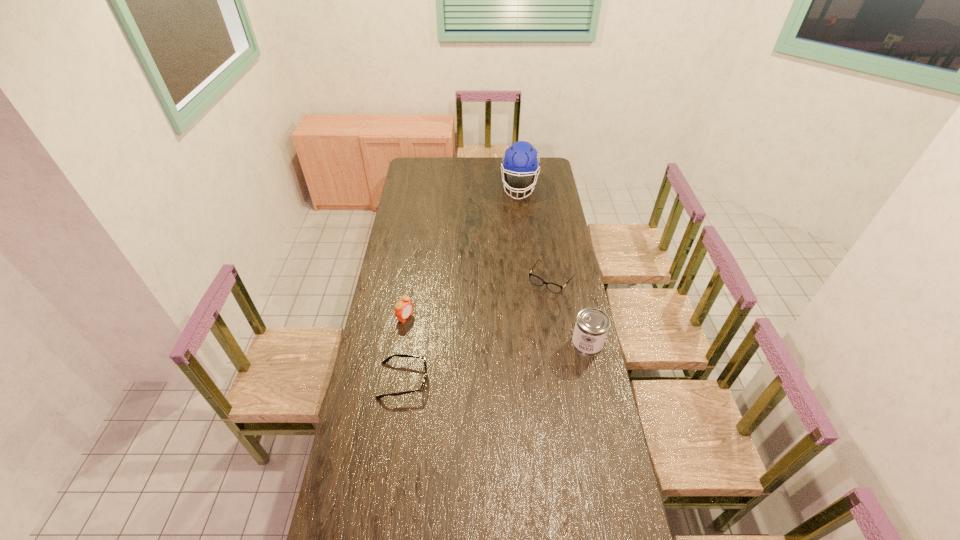
I want to click on free space at the right edge, so click(x=546, y=203).

Image resolution: width=960 pixels, height=540 pixels. Find the location of `vacant space at the far right corner of the desktop`. vacant space at the far right corner of the desktop is located at coordinates (547, 174).

Where is `free spot at the near right corner of the desktop`? This screenshot has height=540, width=960. free spot at the near right corner of the desktop is located at coordinates (602, 516).

Locate an element on the screen. free space between the tallest object and the fourth farthest object is located at coordinates (553, 265).

Where is `empty location between the fourth shortest object and the tallest object`? empty location between the fourth shortest object and the tallest object is located at coordinates (553, 265).

At what (x,y) coordinates should I click in order to perform the action: click on free point between the third shortest object and the second farthest object. Please return your answer as a coordinate pair (x, y). Looking at the image, I should click on (478, 298).

Where is `free point between the third shortest object and the nearest object`? free point between the third shortest object and the nearest object is located at coordinates (404, 349).

Image resolution: width=960 pixels, height=540 pixels. I want to click on free space that is in between the fourth nearest object and the tallest object, so click(x=536, y=233).

The width and height of the screenshot is (960, 540). I want to click on free point between the tallest object and the fourth shortest object, so click(553, 265).

In order to click on vacant point located between the nearer spectacles and the tallest object in this screenshot , I will do `click(461, 284)`.